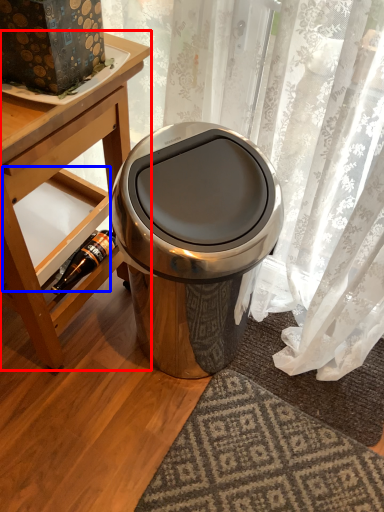
Question: Which of the following is the farthest to the observer, table (highlighted by a red box) or shelf (highlighted by a blue box)?

Choices:
 (A) table
 (B) shelf

Answer: (B)